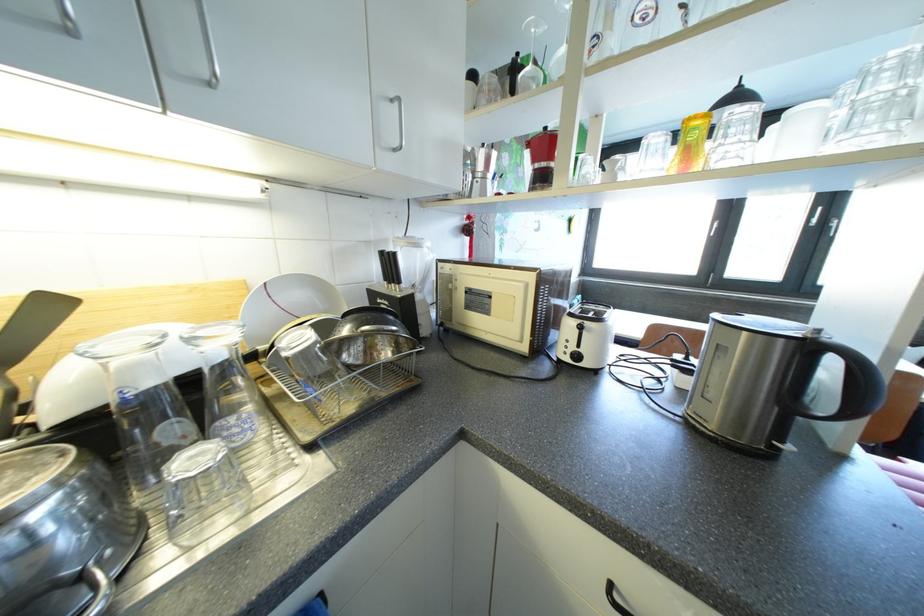
The width and height of the screenshot is (924, 616). In order to click on white cabinet handle in this screenshot , I will do `click(208, 46)`.